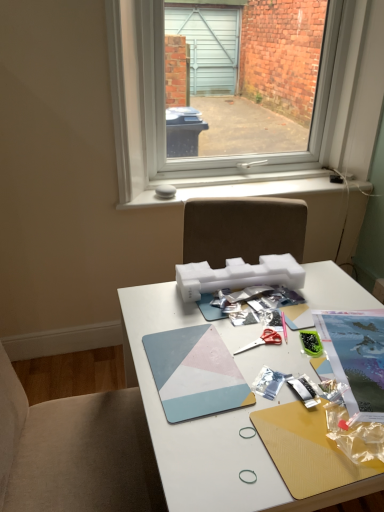
The image size is (384, 512). I want to click on free space behind red plastic scissors at center, so click(x=245, y=310).